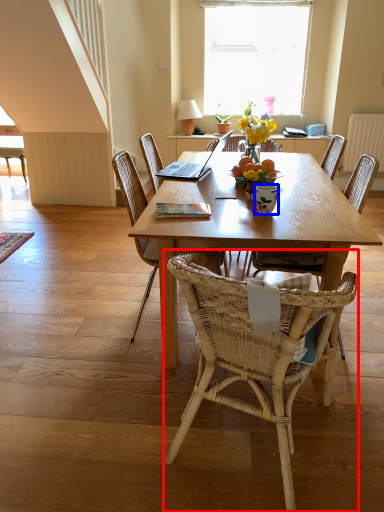
Question: Which point is closer to the camera, chair (highlighted by a red box) or coffee cup (highlighted by a blue box)?

Choices:
 (A) chair
 (B) coffee cup

Answer: (A)